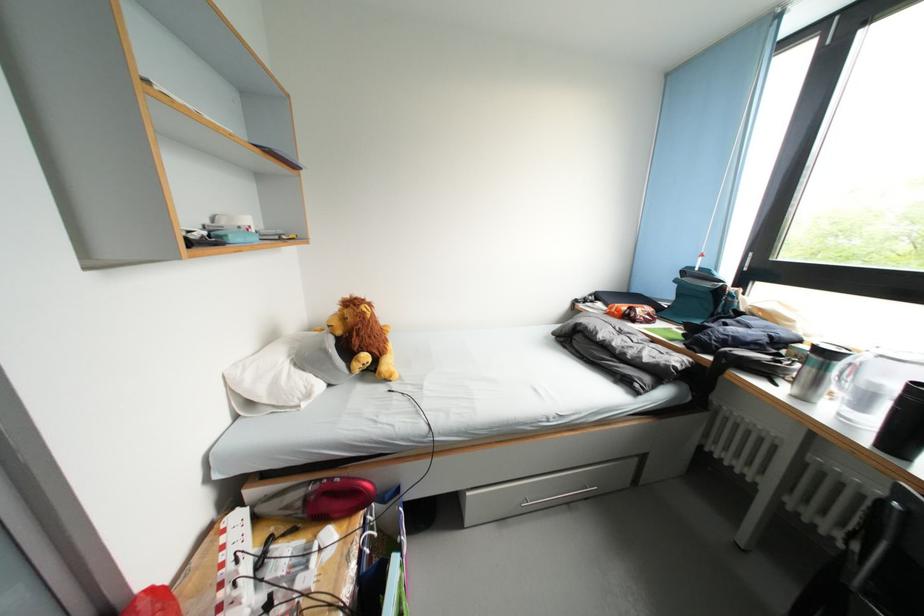
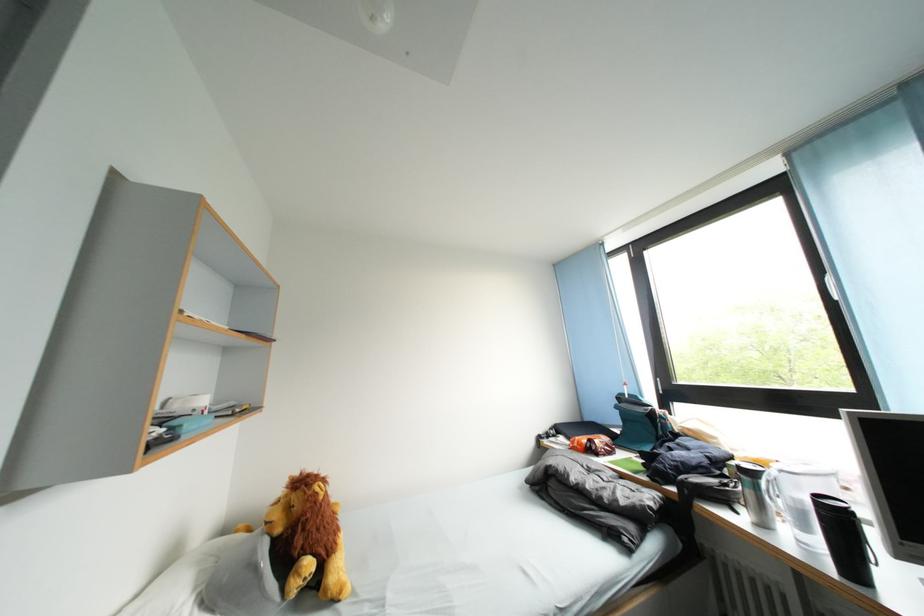
Where in the second image is the point corresponding to the point at 850,421 from the first image?

(808, 546)